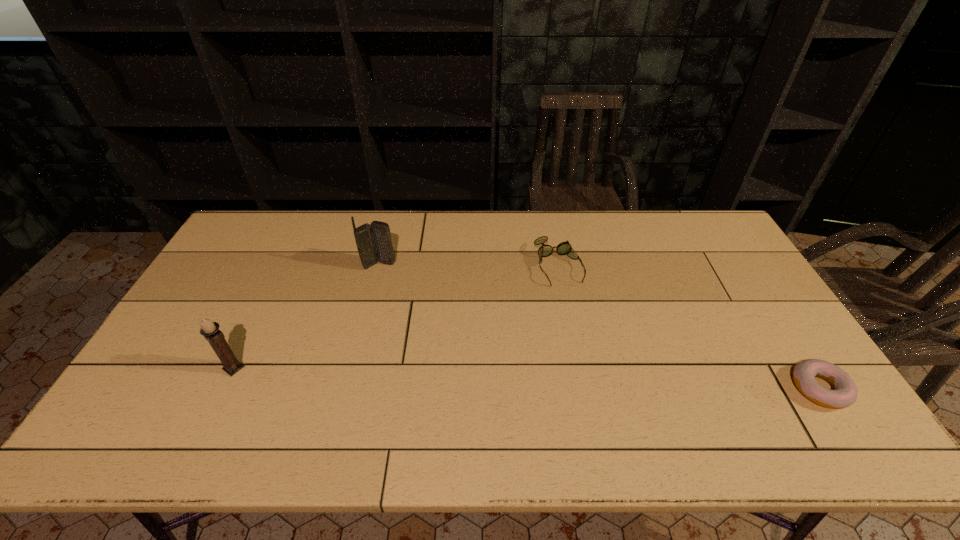
At what (x,y) coordinates should I click in order to perform the action: click on vacant space at the left edge of the desktop. Please return your answer as a coordinate pair (x, y). This screenshot has height=540, width=960. Looking at the image, I should click on (230, 284).

The height and width of the screenshot is (540, 960). Identify the location of free point at the right edge. (693, 263).

The height and width of the screenshot is (540, 960). Find the location of `vacant space at the near left corner of the desktop`. vacant space at the near left corner of the desktop is located at coordinates (200, 385).

This screenshot has width=960, height=540. In order to click on vacant space at the near right corner of the desktop in this screenshot , I will do `click(779, 406)`.

The image size is (960, 540). Identify the location of free spot between the third object from right to left and the leftmost object. (306, 316).

Where is `free point between the rightmost object and the leftmost object`? The width and height of the screenshot is (960, 540). free point between the rightmost object and the leftmost object is located at coordinates point(527,378).

Locate an element on the screen. Image resolution: width=960 pixels, height=540 pixels. unoccupied position between the leftmost object and the third object from left to right is located at coordinates (396, 317).

You are a GUI agent. You are given a task and a screenshot of the screen. Output one action in this format:
    pyautogui.click(x=<x>, y=<y>)
    Task: Click on the free area in between the cellular telephone and the leftmost object
    The width and height of the screenshot is (960, 540).
    Given the screenshot: What is the action you would take?
    pyautogui.click(x=306, y=316)

The width and height of the screenshot is (960, 540). In order to click on free space between the shortest object and the second object from left to right in this screenshot , I will do `click(599, 327)`.

You are a GUI agent. You are given a task and a screenshot of the screen. Output one action in this format:
    pyautogui.click(x=<x>, y=<y>)
    Task: Click on the free point between the cellular telephone and the rightmost object
    This screenshot has width=960, height=540.
    Given the screenshot: What is the action you would take?
    pyautogui.click(x=599, y=327)